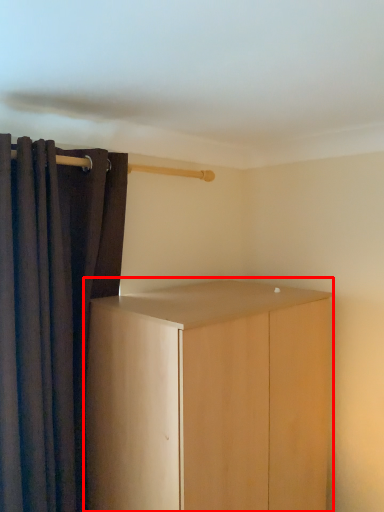
Question: From the image's perspective, what is the correct spatial positioning of cupboard (annotated by the red box) in reference to curtain?

Choices:
 (A) below
 (B) above

Answer: (A)